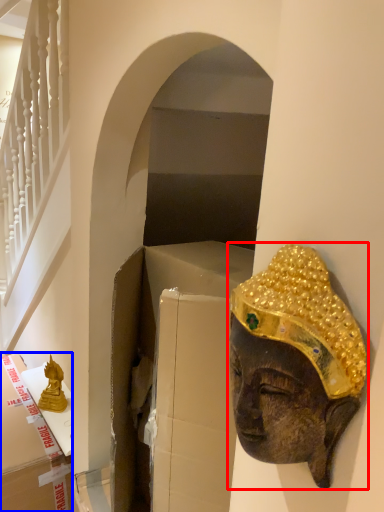
Question: Which point is further to the camera, person (highlighted by a red box) or cardboard box (highlighted by a blue box)?

Choices:
 (A) person
 (B) cardboard box

Answer: (B)